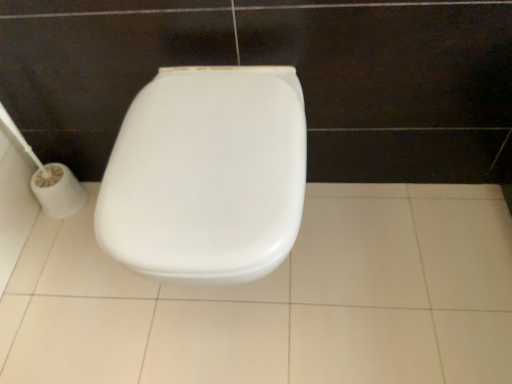
Question: Is point (174, 190) closer or farther from the camera than point (50, 210)?

Choices:
 (A) farther
 (B) closer

Answer: (B)

Question: Is white plastic toilet at center to the left or to the right of white plastic toilet paper at left in the image?

Choices:
 (A) left
 (B) right

Answer: (B)

Question: Based on their relative distances, which object is farther from the white glossy tile at center?

Choices:
 (A) white plastic toilet at center
 (B) white plastic toilet paper at left

Answer: (B)

Question: Which of these objects is positioned farthest from the white glossy tile at center?

Choices:
 (A) white plastic toilet paper at left
 (B) white plastic toilet at center

Answer: (A)